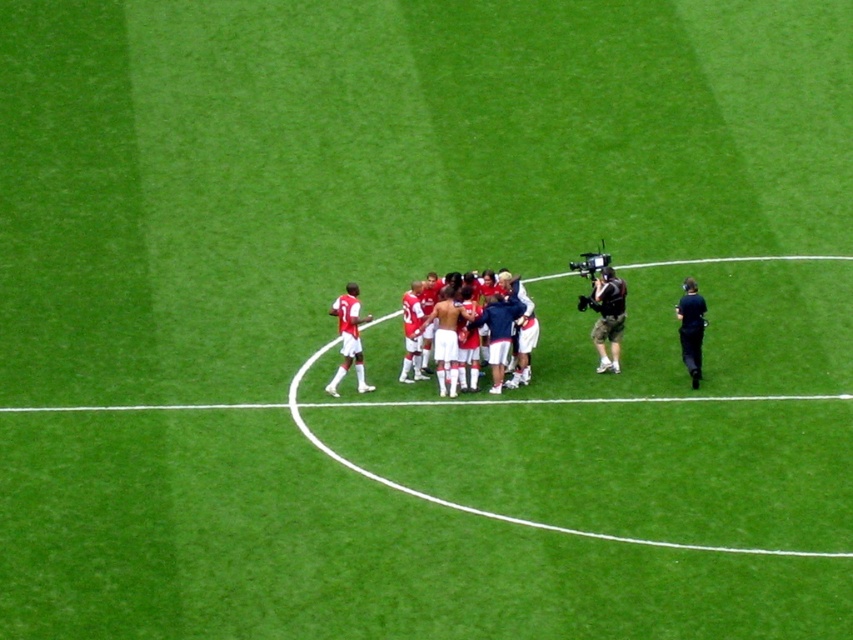
Question: Can you confirm if matte white shorts at center is wider than black fabric referee at right?

Choices:
 (A) no
 (B) yes

Answer: (B)

Question: Is camouflage-patterned shorts at center bigger than black fabric referee at right?

Choices:
 (A) no
 (B) yes

Answer: (B)

Question: Which object is closer to the camera taking this photo?

Choices:
 (A) red matte soccer players at center
 (B) matte white shorts at center

Answer: (B)

Question: Which object is positioned farthest from the red matte soccer players at center?

Choices:
 (A) black fabric referee at right
 (B) camouflage-patterned shorts at center
 (C) matte white shorts at center

Answer: (A)

Question: Considering the relative positions of matte white shorts at center and black fabric referee at right in the image provided, where is matte white shorts at center located with respect to black fabric referee at right?

Choices:
 (A) above
 (B) below

Answer: (B)

Question: Which object is the closest to the black fabric referee at right?

Choices:
 (A) red matte soccer players at center
 (B) matte white shorts at center
 (C) camouflage-patterned shorts at center

Answer: (C)